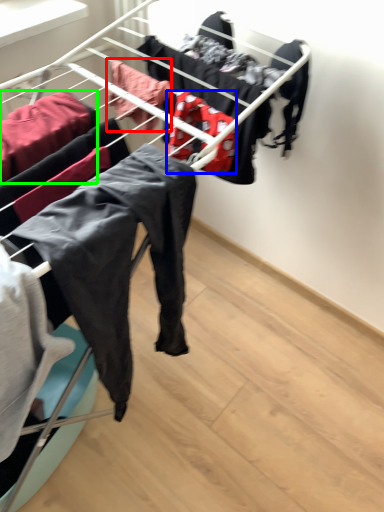
Question: Considering the real-world distances, which object is closest to clothing (highlighted by a red box)? clothing (highlighted by a blue box) or clothing (highlighted by a green box).

Choices:
 (A) clothing
 (B) clothing

Answer: (A)